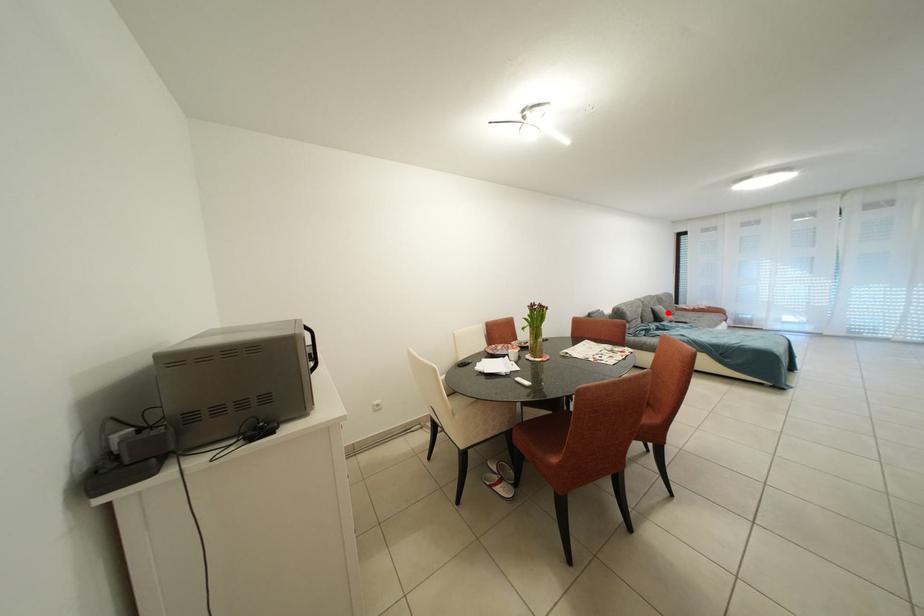
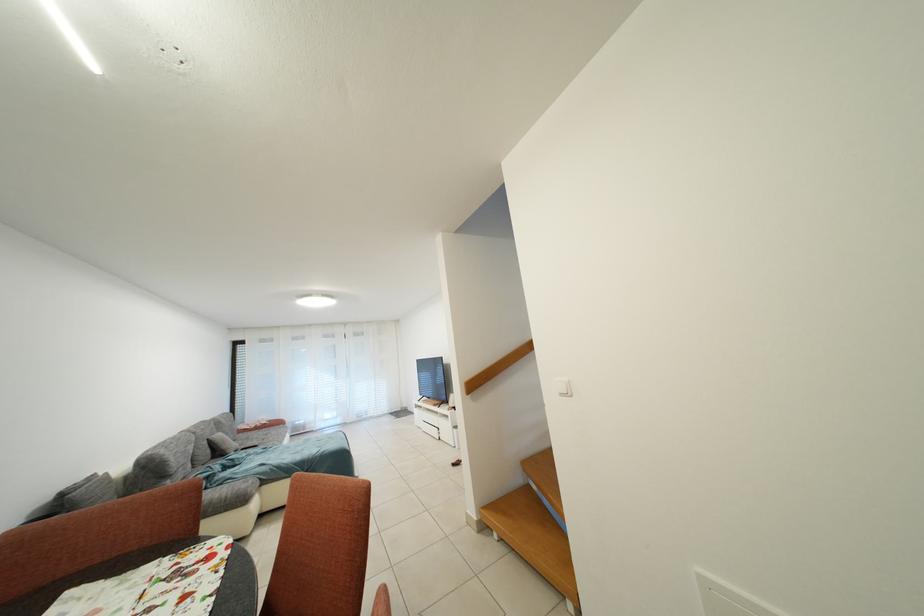
Question: I am providing you with two images of the same scene from different viewpoints. Image1 has a red point marked. In image2, the corresponding 3D location appears at what relative position? Reply with the corresponding letter.

Choices:
 (A) Closer
 (B) Farther

Answer: (A)